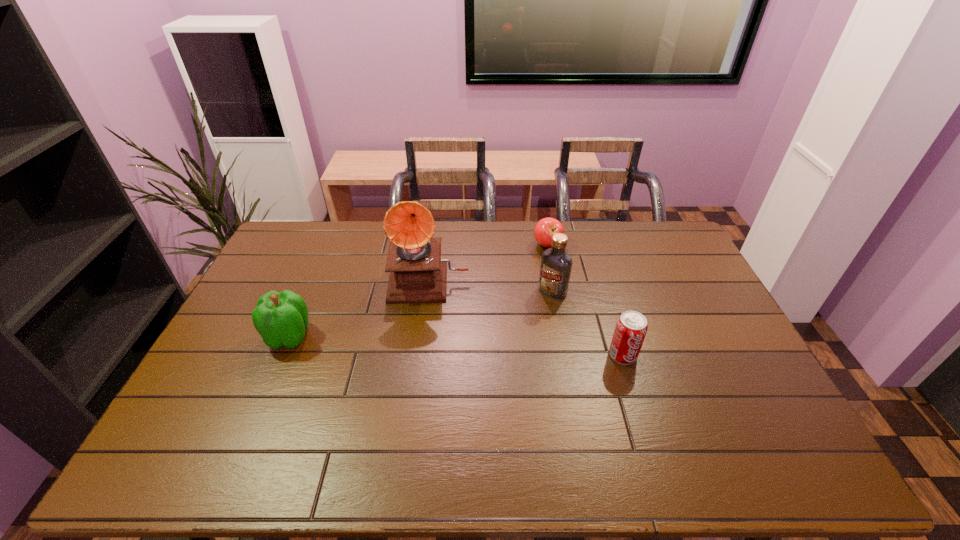
Find the location of `vacant space on the desktop that is between the leftmost object and the second shortest object and is positioned on the stem of the shortest object`. vacant space on the desktop that is between the leftmost object and the second shortest object and is positioned on the stem of the shortest object is located at coordinates (475, 347).

The image size is (960, 540). Find the location of `vacant space on the desktop that is between the bell pepper and the soda can and is positioned on the horn of the fourth object from right to left`. vacant space on the desktop that is between the bell pepper and the soda can and is positioned on the horn of the fourth object from right to left is located at coordinates (425, 344).

The height and width of the screenshot is (540, 960). What are the coordinates of `vacant spot on the desktop that is between the leftmost object and the fourth tallest object and is positioned on the front-facing side of the vodka` in the screenshot? It's located at (492, 348).